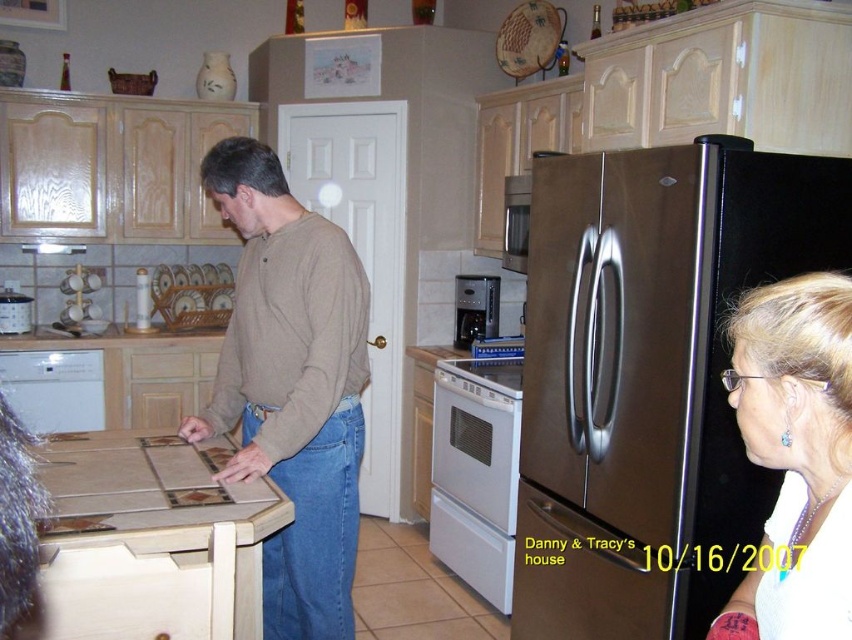
You are planning to move the stainless steel refrigerator at right and the white glossy dishwasher at lower left to a new kitchen layout. If you want to place them side by side along a wall, which one should be placed first to ensure they fit properly?

The white glossy dishwasher at lower left should be placed first since it is smaller than the stainless steel refrigerator at right, allowing enough space for both when placed side by side.

You are a delivery person who needs to place a package on the kitchen counter between the white glossy hair at upper right and the satin silver microwave at center. The package requires 2 feet of space. Is there enough space?

The distance between the white glossy hair at upper right and the satin silver microwave at center is 8.48 feet, which is more than enough to accommodate the 2 feet required for the package.